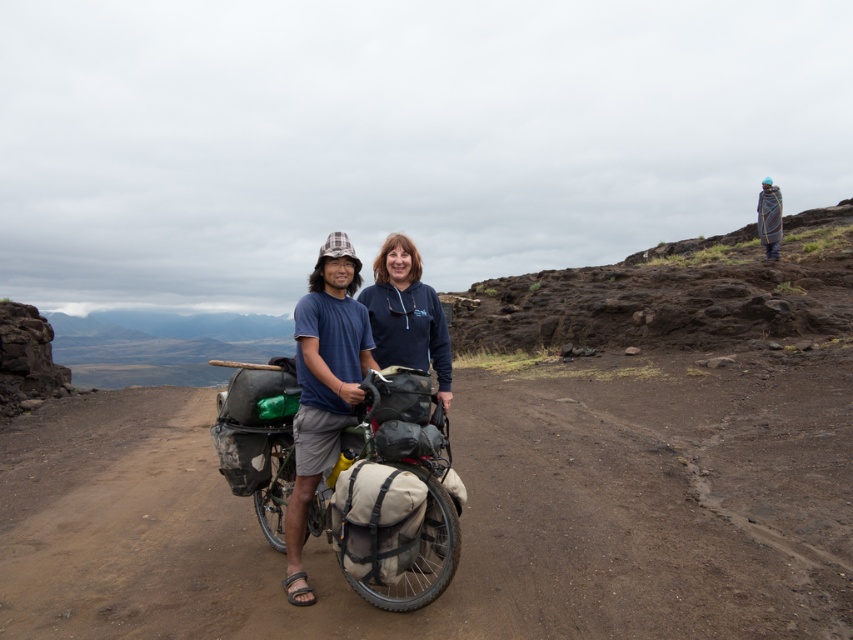
Between beige canvas bicycle at center and dark blue hoodie at center, which one has more height?

beige canvas bicycle at center is taller.

Between point (265, 436) and point (437, 336), which one is positioned in front?

Point (265, 436) is more forward.

Does point (265, 472) lie behind point (369, 312)?

Yes.

Identify the location of beige canvas bicycle at center. The height and width of the screenshot is (640, 853). (425, 496).

The image size is (853, 640). What do you see at coordinates (425, 496) in the screenshot?
I see `beige canvas bicycle at center` at bounding box center [425, 496].

Between beige canvas bicycle at center and matte blue shirt at center, which one appears on the left side from the viewer's perspective?

Positioned to the left is matte blue shirt at center.

The width and height of the screenshot is (853, 640). Describe the element at coordinates (425, 496) in the screenshot. I see `beige canvas bicycle at center` at that location.

This screenshot has height=640, width=853. I want to click on beige canvas bicycle at center, so click(x=425, y=496).

Between brown dirt track at center and dark blue hoodie at center, which one has more height?

With more height is brown dirt track at center.

Which is behind, point (254, 595) or point (386, 321)?

Positioned behind is point (386, 321).

What are the coordinates of `brown dirt track at center` in the screenshot? It's located at (465, 509).